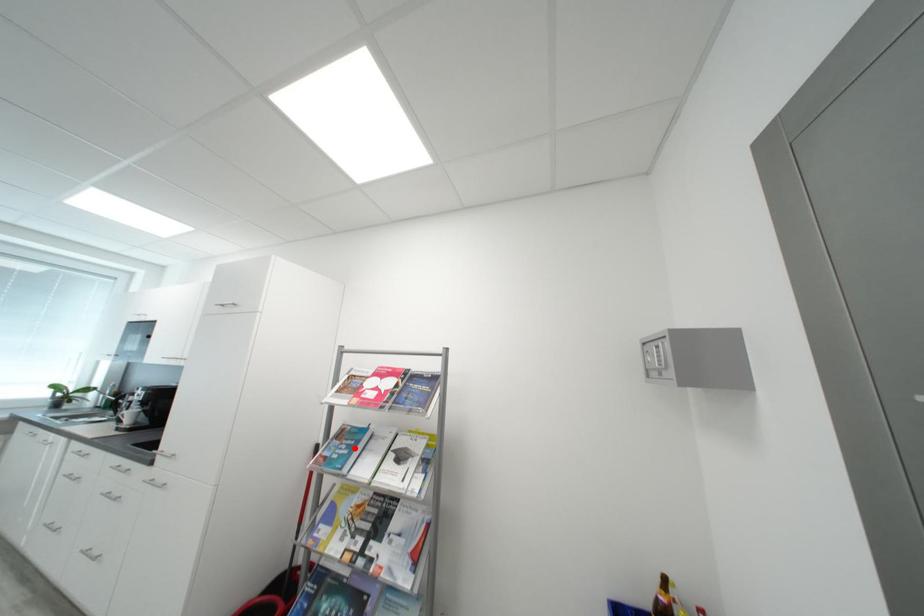
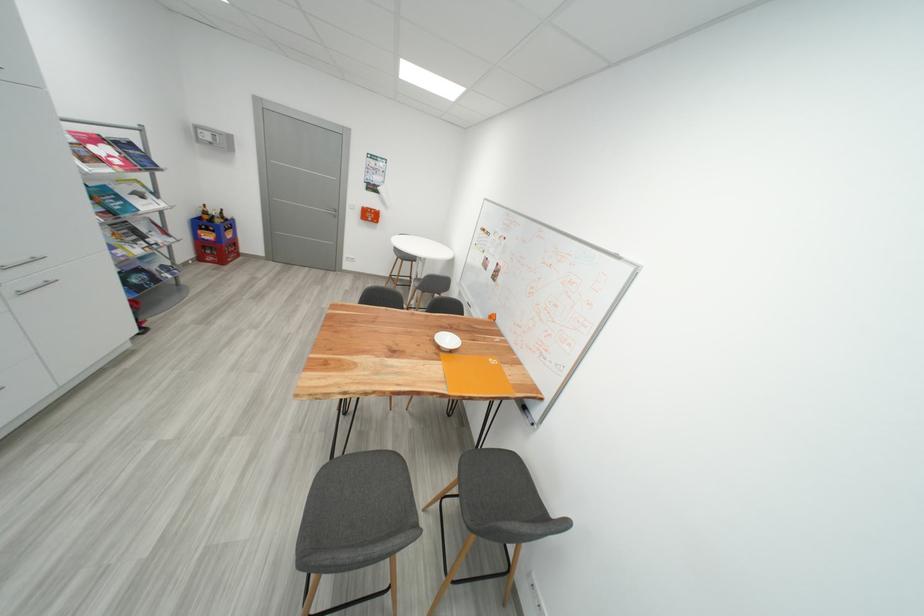
Question: A red point is marked in image1. In image2, is the corresponding 3D point closer to the camera or farther? Reply with the corresponding letter.

Choices:
 (A) The corresponding 3D point is closer.
 (B) The corresponding 3D point is farther.

Answer: (B)